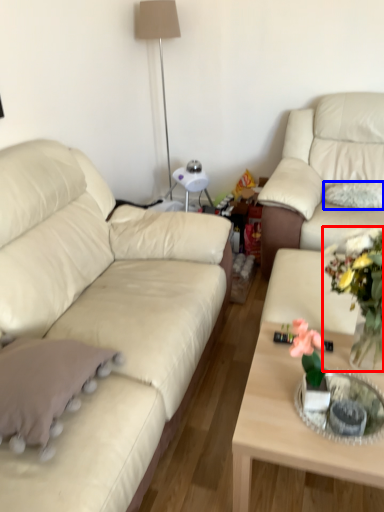
Question: Which object is closer to the camera taking this photo, floral arrangement (highlighted by a red box) or pillow (highlighted by a blue box)?

Choices:
 (A) floral arrangement
 (B) pillow

Answer: (A)